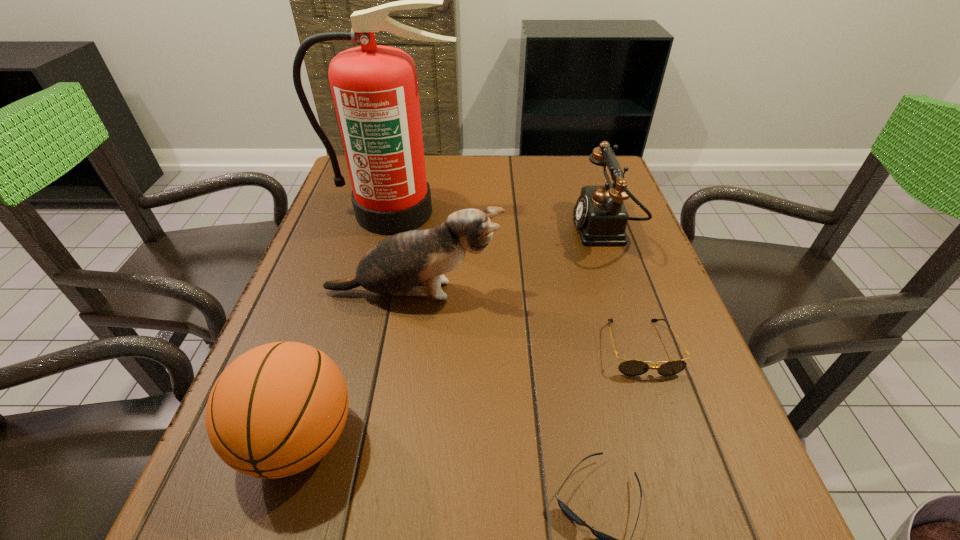
Locate an element on the screen. The height and width of the screenshot is (540, 960). vacant space in between the fire extinguisher and the fourth farthest object is located at coordinates (517, 280).

Identify the location of object that is the second closest to the basketball. This screenshot has width=960, height=540. (605, 539).

Locate an element on the screen. The height and width of the screenshot is (540, 960). object that is the closest to the shortest object is located at coordinates (629, 367).

Identify the location of free location that satisfies the following two spatial constraints: 1. on the front of the telephone at the rotary dial; 2. on the lenses of the taller sunglasses. (645, 348).

Identify the location of vacant space that satisfies the following two spatial constraints: 1. at the face of the cat; 2. on the front side of the basketball. This screenshot has height=540, width=960. (391, 439).